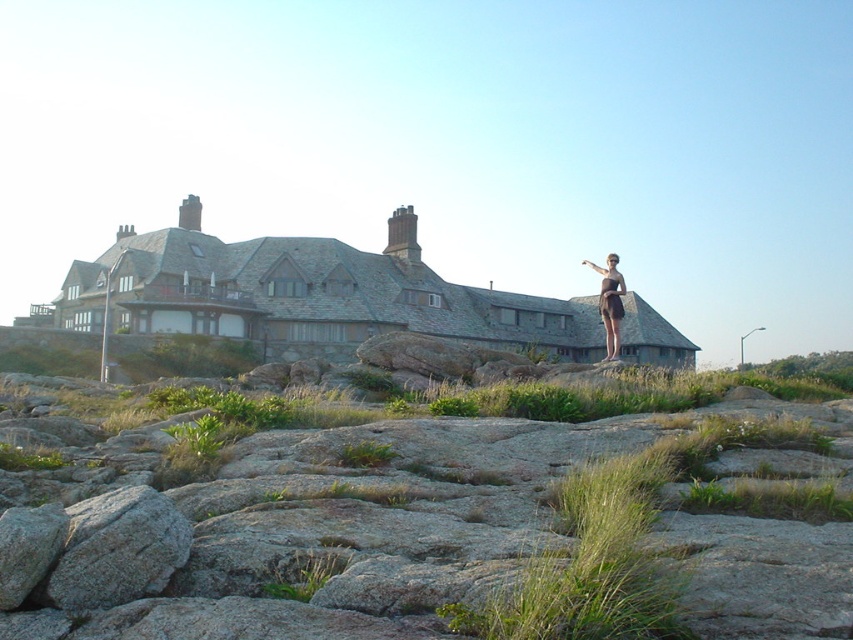
Question: Can you confirm if gray rock at upper center is smaller than brown matte dress at upper right?

Choices:
 (A) yes
 (B) no

Answer: (A)

Question: Which object appears closest to the camera in this image?

Choices:
 (A) brown matte dress at upper right
 (B) gray rock at upper center

Answer: (B)

Question: Is gray rock at upper center positioned behind brown matte dress at upper right?

Choices:
 (A) yes
 (B) no

Answer: (B)

Question: Is gray rock at upper center above brown matte dress at upper right?

Choices:
 (A) no
 (B) yes

Answer: (A)